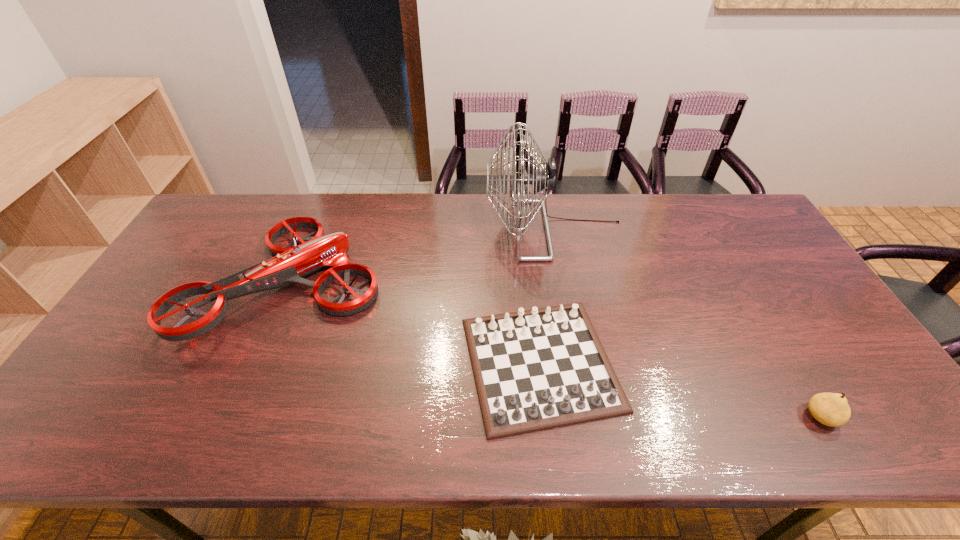
Where is `free space at the right edge of the desktop`? free space at the right edge of the desktop is located at coordinates (863, 394).

Locate an element on the screen. vacant area that lies between the tallest object and the pear is located at coordinates (688, 323).

Locate an element on the screen. free space that is in between the rightmost object and the fan is located at coordinates (688, 323).

The image size is (960, 540). I want to click on vacant space in between the pear and the shortest object, so click(681, 390).

Image resolution: width=960 pixels, height=540 pixels. In order to click on blank region between the leftmost object and the tallest object in this screenshot , I will do `click(422, 256)`.

At what (x,y) coordinates should I click in order to perform the action: click on blank region between the fan and the leftmost object. Please return your answer as a coordinate pair (x, y). This screenshot has width=960, height=540. Looking at the image, I should click on (422, 256).

The height and width of the screenshot is (540, 960). Find the location of `free space between the chessboard and the tallest object`. free space between the chessboard and the tallest object is located at coordinates (547, 297).

In order to click on empty space between the rightmost object and the shortest object in this screenshot , I will do `click(681, 390)`.

I want to click on free space between the chessboard and the pear, so pyautogui.click(x=681, y=390).

Where is `free space between the leftmost object and the fan`? This screenshot has height=540, width=960. free space between the leftmost object and the fan is located at coordinates pyautogui.click(x=422, y=256).